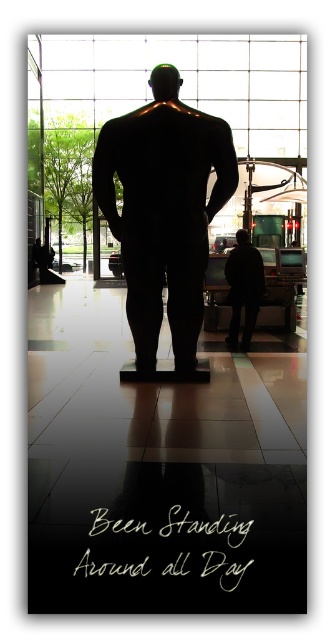
Question: Does black matte mannequin at center appear under dark matte figure at center?

Choices:
 (A) yes
 (B) no

Answer: (B)

Question: Among these points, which one is farthest from the camera?

Choices:
 (A) (164, 88)
 (B) (237, 268)

Answer: (B)

Question: In this image, where is black matte mannequin at center located relative to dark matte figure at center?

Choices:
 (A) below
 (B) above

Answer: (B)

Question: Is black matte mannequin at center to the right of dark matte figure at center from the viewer's perspective?

Choices:
 (A) no
 (B) yes

Answer: (A)